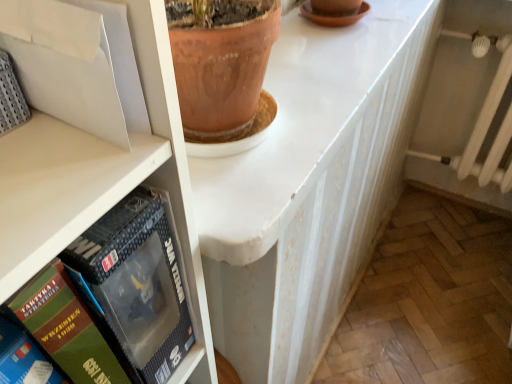
Question: Can you confirm if white glossy counter top at center is smaller than green matte book at left, arranged as the 2th book when viewed from the left?

Choices:
 (A) no
 (B) yes

Answer: (A)

Question: From a real-world perspective, is white glossy counter top at center beneath green matte book at left, arranged as the 2th book when viewed from the left?

Choices:
 (A) no
 (B) yes

Answer: (A)

Question: Is white glossy counter top at center not inside green matte book at left, arranged as the 2th book when viewed from the left?

Choices:
 (A) no
 (B) yes

Answer: (B)

Question: Is white glossy counter top at center further to the viewer compared to green matte book at left, arranged as the 2th book when viewed from the left?

Choices:
 (A) yes
 (B) no

Answer: (A)

Question: Considering the relative positions of white glossy counter top at center and green matte book at left, the second book when ordered from right to left, in the image provided, is white glossy counter top at center to the left of green matte book at left, the second book when ordered from right to left, from the viewer's perspective?

Choices:
 (A) no
 (B) yes

Answer: (A)

Question: In terms of size, does white glossy counter top at center appear bigger or smaller than matte black box at left, the first book viewed from the right?

Choices:
 (A) big
 (B) small

Answer: (A)

Question: Is point (244, 168) positioned closer to the camera than point (157, 377)?

Choices:
 (A) closer
 (B) farther

Answer: (B)

Question: From a real-world perspective, relative to matte black box at left, which is the 3th book in left-to-right order, is white glossy counter top at center vertically above or below?

Choices:
 (A) above
 (B) below

Answer: (A)

Question: From the image's perspective, relative to matte black box at left, which is the 3th book in left-to-right order, is white glossy counter top at center above or below?

Choices:
 (A) below
 (B) above

Answer: (B)

Question: Is green cardboard book at lower left, the 1th book from the left, situated inside white glossy counter top at center or outside?

Choices:
 (A) inside
 (B) outside

Answer: (B)

Question: Visually, is green cardboard book at lower left, the 1th book from the left, positioned to the left or to the right of white glossy counter top at center?

Choices:
 (A) left
 (B) right

Answer: (A)

Question: Is point (67, 380) positioned closer to the camera than point (307, 48)?

Choices:
 (A) farther
 (B) closer

Answer: (B)

Question: From a real-world perspective, is green cardboard book at lower left, marked as the third book in a right-to-left arrangement, physically located above or below white glossy counter top at center?

Choices:
 (A) above
 (B) below

Answer: (A)

Question: In terms of width, does matte black box at left, which is the 3th book in left-to-right order, look wider or thinner when compared to green cardboard book at lower left, marked as the third book in a right-to-left arrangement?

Choices:
 (A) wide
 (B) thin

Answer: (B)

Question: Does point (117, 306) appear closer or farther from the camera than point (34, 369)?

Choices:
 (A) farther
 (B) closer

Answer: (A)